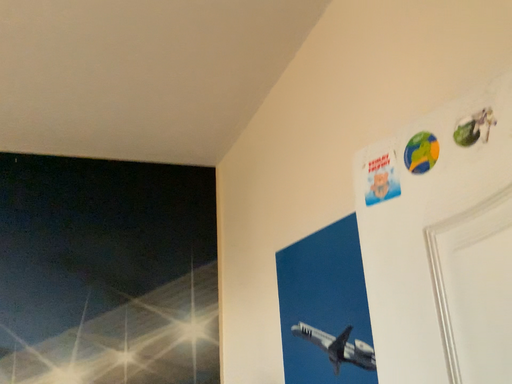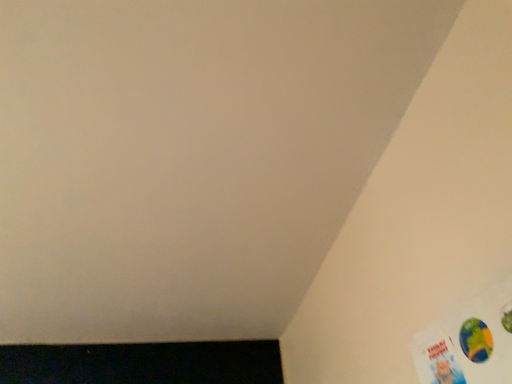
Question: How did the camera likely rotate when shooting the video?

Choices:
 (A) rotated upward
 (B) rotated downward

Answer: (A)